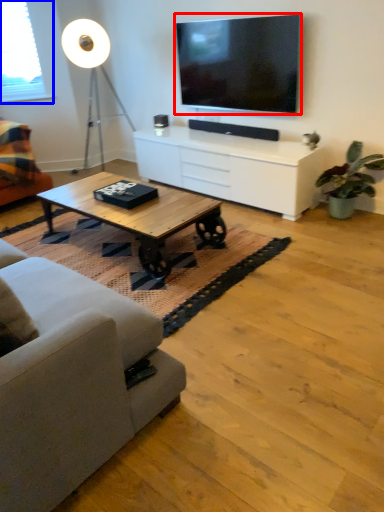
Question: Which point is closer to the camera, television (highlighted by a red box) or window screen (highlighted by a blue box)?

Choices:
 (A) television
 (B) window screen

Answer: (A)